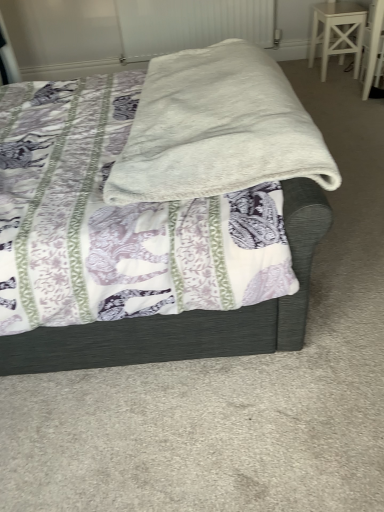
Question: Is white textured radiator at upper center inside or outside of white soft blanket at center?

Choices:
 (A) outside
 (B) inside

Answer: (A)

Question: From the image's perspective, relative to white soft blanket at center, is white textured radiator at upper center above or below?

Choices:
 (A) below
 (B) above

Answer: (B)

Question: Which object is the farthest from the white textured radiator at upper center?

Choices:
 (A) white soft blanket at center
 (B) white painted wood stool at upper right
 (C) white soft blanket at center

Answer: (C)

Question: Which object is positioned farthest from the white soft blanket at center?

Choices:
 (A) white textured radiator at upper center
 (B) white soft blanket at center
 (C) white painted wood stool at upper right

Answer: (A)